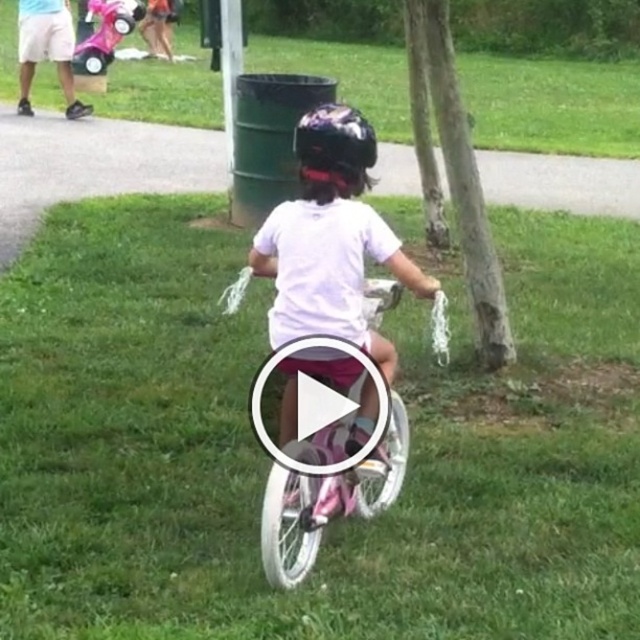
You are a parent watching your child ride a bicycle in the park. You notice the pink metallic bicycle at center and the shiny purple helmet at center. Which object is taller?

The pink metallic bicycle at center is much taller than the shiny purple helmet at center.

You are a parent in the park and see your child riding a bicycle. You notice a green trash can near a tree on the right side of the frame. Where is the pink plastic tricycle at upper left located relative to the green grass at center?

The pink plastic tricycle at upper left is to the left of the green grass at center.

You are a parent trying to locate your child in the park. You remember your child was wearing a shiny purple helmet at center and riding a pink metallic bicycle at center. Based on the scene, which object is positioned more to the left?

The shiny purple helmet at center is positioned more to the left compared to the pink metallic bicycle at center, as the bicycle is to the right of the helmet.